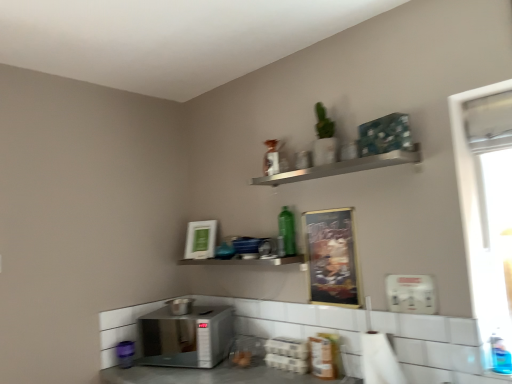
The width and height of the screenshot is (512, 384). What do you see at coordinates (200, 239) in the screenshot?
I see `green matte picture frame at upper center` at bounding box center [200, 239].

You are a GUI agent. You are given a task and a screenshot of the screen. Output one action in this format:
    pyautogui.click(x=<x>, y=<y>)
    Task: Click on the metallic silver shelf at center, the 2th shelf when ordered from top to bottom
    The height and width of the screenshot is (384, 512).
    Given the screenshot: What is the action you would take?
    pyautogui.click(x=245, y=261)

Describe the element at coordinates (186, 337) in the screenshot. I see `satin silver microwave at lower center, which appears as the second appliance when viewed from the front` at that location.

Locate an element on the screen. blue plastic bottle at lower right, which appears as the 1th bottle when ordered from the bottom is located at coordinates (500, 353).

In order to face blue plastic bottle at lower right, the 2th bottle positioned from the left, should I rotate leftwards or rightwards?

You should look right and rotate roughly 29.844 degrees.

The image size is (512, 384). What do you see at coordinates (331, 257) in the screenshot?
I see `metallic gold bulletin board at center` at bounding box center [331, 257].

Locate an element on the screen. The height and width of the screenshot is (384, 512). satin silver toaster at lower left, the 2th appliance ordered from the bottom is located at coordinates (181, 306).

In the scene shown: Does metallic gold bulletin board at center have a lesser height compared to green matte picture frame at upper center?

Incorrect, the height of metallic gold bulletin board at center does not fall short of that of green matte picture frame at upper center.

From the image's perspective, which is below, metallic gold bulletin board at center or green matte picture frame at upper center?

metallic gold bulletin board at center appears lower in the image.

I want to click on picture frame lying behind the metallic gold bulletin board at center, so click(x=200, y=239).

Who is bigger, metallic gold bulletin board at center or green matte picture frame at upper center?

With larger size is green matte picture frame at upper center.

Can you confirm if satin silver microwave at lower center, the 2th appliance positioned from the left, is thinner than silver metallic shelf at upper center, which appears as the 2th shelf when ordered from the bottom?

No, satin silver microwave at lower center, the 2th appliance positioned from the left, is not thinner than silver metallic shelf at upper center, which appears as the 2th shelf when ordered from the bottom.

Who is taller, satin silver microwave at lower center, the 2th appliance positioned from the left, or silver metallic shelf at upper center, which appears as the 2th shelf when ordered from the bottom?

satin silver microwave at lower center, the 2th appliance positioned from the left.

Which object is closer to the camera, satin silver microwave at lower center, marked as the third appliance in a top-to-bottom arrangement, or silver metallic shelf at upper center, the 1th shelf from the top?

Positioned in front is silver metallic shelf at upper center, the 1th shelf from the top.

From the picture: Would you say satin silver microwave at lower center, the 2th appliance positioned from the right, is a long distance from silver metallic shelf at upper center, which appears as the 2th shelf when ordered from the bottom?

That's not correct — satin silver microwave at lower center, the 2th appliance positioned from the right, is a little close to silver metallic shelf at upper center, which appears as the 2th shelf when ordered from the bottom.

Between green matte picture frame at upper center and satin silver toaster at lower left, acting as the third appliance starting from the right, which one has larger size?

Bigger between the two is green matte picture frame at upper center.

Considering the sizes of objects green matte picture frame at upper center and satin silver toaster at lower left, which ranks as the 1th appliance in back-to-front order, in the image provided, who is thinner, green matte picture frame at upper center or satin silver toaster at lower left, which ranks as the 1th appliance in back-to-front order,?

With smaller width is green matte picture frame at upper center.

Consider the image. From a real-world perspective, who is located higher, green matte picture frame at upper center or satin silver toaster at lower left, acting as the 3th appliance starting from the front?

From a 3D spatial view, green matte picture frame at upper center is above.

Looking at this image, is satin silver toaster at lower left, the 2th appliance ordered from the bottom, directly adjacent to white plastic dispenser at lower right, the 3th appliance from the back?

No, satin silver toaster at lower left, the 2th appliance ordered from the bottom, is not beside white plastic dispenser at lower right, the 3th appliance from the back.

Consider the image. Is satin silver toaster at lower left, the 1th appliance in the left-to-right sequence, positioned beyond the bounds of white plastic dispenser at lower right, which is the 1th appliance from top to bottom?

Yes.

In the scene shown: Which of these two, satin silver toaster at lower left, which ranks as the 2th appliance in top-to-bottom order, or white plastic dispenser at lower right, the 3th appliance from the back, stands shorter?

Standing shorter between the two is satin silver toaster at lower left, which ranks as the 2th appliance in top-to-bottom order.

From a real-world perspective, relative to white plastic dispenser at lower right, which is the 1th appliance from top to bottom, is satin silver toaster at lower left, acting as the third appliance starting from the right, vertically above or below?

From a real-world perspective, satin silver toaster at lower left, acting as the third appliance starting from the right, is physically below white plastic dispenser at lower right, which is the 1th appliance from top to bottom.

Considering the relative sizes of metallic gold bulletin board at center and green glass bottle at center, which is the 2th bottle in front-to-back order, in the image provided, is metallic gold bulletin board at center taller than green glass bottle at center, which is the 2th bottle in front-to-back order,?

Yes.

Considering the positions of objects metallic gold bulletin board at center and green glass bottle at center, arranged as the 1th bottle when viewed from the back, in the image provided, who is more to the right, metallic gold bulletin board at center or green glass bottle at center, arranged as the 1th bottle when viewed from the back,?

Positioned to the right is metallic gold bulletin board at center.

Which point is more forward, (345, 239) or (288, 215)?

The point (345, 239) is in front.

Is metallic gold bulletin board at center facing towards green glass bottle at center, which is the 2th bottle in front-to-back order?

No, metallic gold bulletin board at center is not turned towards green glass bottle at center, which is the 2th bottle in front-to-back order.

Does metallic silver shelf at center, the 2th shelf when ordered from top to bottom, have a larger size compared to silver metallic shelf at upper center, which appears as the 2th shelf when ordered from the bottom?

Indeed, metallic silver shelf at center, the 2th shelf when ordered from top to bottom, has a larger size compared to silver metallic shelf at upper center, which appears as the 2th shelf when ordered from the bottom.

Between metallic silver shelf at center, the 1th shelf ordered from the bottom, and silver metallic shelf at upper center, which appears as the 2th shelf when ordered from the bottom, which one has more height?

Standing taller between the two is metallic silver shelf at center, the 1th shelf ordered from the bottom.

Is silver metallic shelf at upper center, which appears as the 2th shelf when ordered from the bottom, at the back of metallic silver shelf at center, the 1th shelf ordered from the bottom?

That's not correct — metallic silver shelf at center, the 1th shelf ordered from the bottom, is not looking away from silver metallic shelf at upper center, which appears as the 2th shelf when ordered from the bottom.

From a real-world perspective, is green glass bottle at center, acting as the 1th bottle starting from the top, on metallic gold bulletin board at center?

Yes.

Measure the distance between green glass bottle at center, which is the 2th bottle in front-to-back order, and metallic gold bulletin board at center.

A distance of 8.14 inches exists between green glass bottle at center, which is the 2th bottle in front-to-back order, and metallic gold bulletin board at center.

Who is shorter, green glass bottle at center, which is the second bottle in right-to-left order, or metallic gold bulletin board at center?

green glass bottle at center, which is the second bottle in right-to-left order.

Based on the photo, considering the relative sizes of green glass bottle at center, which is the 2th bottle in front-to-back order, and metallic gold bulletin board at center in the image provided, is green glass bottle at center, which is the 2th bottle in front-to-back order, bigger than metallic gold bulletin board at center?

Incorrect, green glass bottle at center, which is the 2th bottle in front-to-back order, is not larger than metallic gold bulletin board at center.

This screenshot has height=384, width=512. What are the coordinates of `bulletin board located on the right of green matte picture frame at upper center` in the screenshot? It's located at (331, 257).

From the image's perspective, starting from the satin silver microwave at lower center, which appears as the 2th appliance when viewed from the back, which shelf is the 2nd one above? Please provide its 2D coordinates.

[(343, 167)]

When comparing their distances from metallic silver shelf at center, the 1th shelf ordered from the bottom, does green glass bottle at center, which is the 2th bottle in front-to-back order, or satin silver microwave at lower center, the 2th appliance positioned from the right, seem closer?

Among the two, green glass bottle at center, which is the 2th bottle in front-to-back order, is located nearer to metallic silver shelf at center, the 1th shelf ordered from the bottom.

Estimate the real-world distances between objects in this image. Which object is closer to white plastic dispenser at lower right, which appears as the third appliance when ordered from the bottom, silver metallic shelf at upper center, the 1th shelf from the top, or green glass bottle at center, which is the 2th bottle in front-to-back order?

silver metallic shelf at upper center, the 1th shelf from the top, is positioned closer to the anchor white plastic dispenser at lower right, which appears as the third appliance when ordered from the bottom.

Considering their positions, is satin silver toaster at lower left, the 1th appliance in the left-to-right sequence, positioned closer to metallic gold bulletin board at center than blue plastic bottle at lower right, placed as the first bottle when sorted from right to left?

Among the two, blue plastic bottle at lower right, placed as the first bottle when sorted from right to left, is located nearer to metallic gold bulletin board at center.

When comparing their distances from satin silver microwave at lower center, the 2th appliance positioned from the left, does satin silver toaster at lower left, the 2th appliance ordered from the bottom, or metallic gold bulletin board at center seem closer?

satin silver toaster at lower left, the 2th appliance ordered from the bottom, is positioned closer to the anchor satin silver microwave at lower center, the 2th appliance positioned from the left.

Based on their spatial positions, is blue plastic bottle at lower right, which is the second bottle from top to bottom, or metallic gold bulletin board at center closer to green glass bottle at center, which is the second bottle in right-to-left order?

Among the two, metallic gold bulletin board at center is located nearer to green glass bottle at center, which is the second bottle in right-to-left order.

Considering their positions, is metallic silver shelf at center, the 1th shelf ordered from the bottom, positioned further to green matte picture frame at upper center than satin silver microwave at lower center, the 2th appliance positioned from the right?

The object further to green matte picture frame at upper center is satin silver microwave at lower center, the 2th appliance positioned from the right.

From the image, which object appears to be farther from white plastic window screen at right, blue plastic bottle at lower right, which is the second bottle from top to bottom, or metallic gold bulletin board at center?

metallic gold bulletin board at center lies further to white plastic window screen at right than the other object.

Consider the image. When comparing their distances from satin silver toaster at lower left, which ranks as the 2th appliance in top-to-bottom order, does silver metallic shelf at upper center, which appears as the 2th shelf when ordered from the bottom, or metallic gold bulletin board at center seem closer?

Among the two, metallic gold bulletin board at center is located nearer to satin silver toaster at lower left, which ranks as the 2th appliance in top-to-bottom order.

Image resolution: width=512 pixels, height=384 pixels. Find the location of `shelf between metallic silver shelf at center, the 1th shelf ordered from the bottom, and blue plastic bottle at lower right, the first bottle positioned from the front`. shelf between metallic silver shelf at center, the 1th shelf ordered from the bottom, and blue plastic bottle at lower right, the first bottle positioned from the front is located at coordinates (343, 167).

At what (x,y) coordinates should I click in order to perform the action: click on shelf between green matte picture frame at upper center and satin silver microwave at lower center, marked as the third appliance in a top-to-bottom arrangement, from top to bottom. Please return your answer as a coordinate pair (x, y). Image resolution: width=512 pixels, height=384 pixels. Looking at the image, I should click on (245, 261).

Locate an element on the screen. appliance between metallic gold bulletin board at center and white plastic window screen at right in the horizontal direction is located at coordinates (411, 294).

Where is `bulletin board between metallic silver shelf at center, the 1th shelf ordered from the bottom, and white plastic dispenser at lower right, which is counted as the 1th appliance, starting from the right, from left to right`? The image size is (512, 384). bulletin board between metallic silver shelf at center, the 1th shelf ordered from the bottom, and white plastic dispenser at lower right, which is counted as the 1th appliance, starting from the right, from left to right is located at coordinates (331, 257).